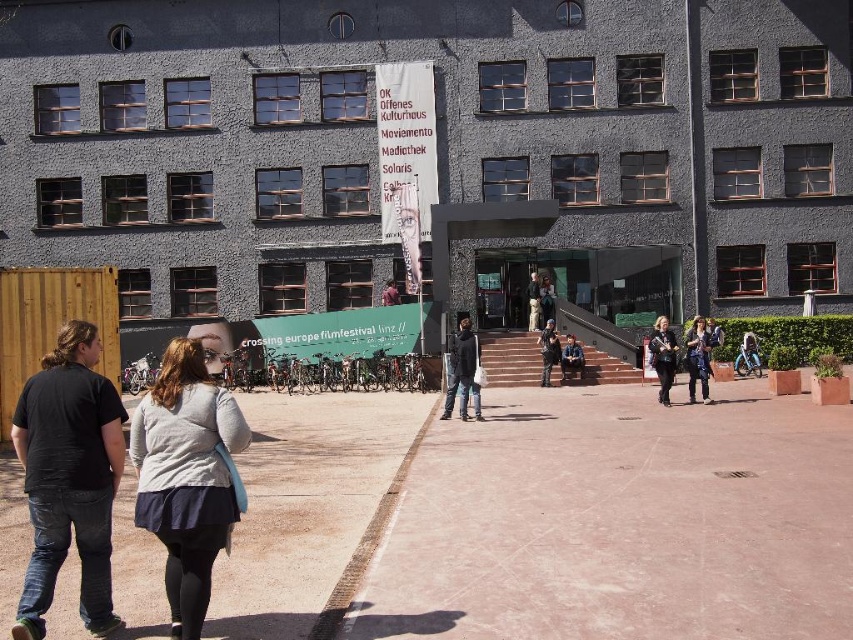
Question: Estimate the real-world distances between objects in this image. Which object is closer to the light gray sweater at center?

Choices:
 (A) camouflage jacket at center
 (B) matte black jacket at lower right

Answer: (B)

Question: Does denim jacket at center appear on the left side of denim jacket at lower right?

Choices:
 (A) no
 (B) yes

Answer: (B)

Question: Does paved concrete sidewalk at lower left appear under denim jacket at lower right?

Choices:
 (A) yes
 (B) no

Answer: (A)

Question: Which point is closer to the camera?

Choices:
 (A) click(x=103, y=580)
 (B) click(x=660, y=333)
 (C) click(x=97, y=353)

Answer: (A)

Question: Which of these objects is positioned farthest from the matte black jacket at lower right?

Choices:
 (A) black cotton shirt at left
 (B) light gray sweater at center
 (C) denim jacket at lower right

Answer: (B)

Question: Is denim jacket at center to the left of matte black jacket at lower right from the viewer's perspective?

Choices:
 (A) yes
 (B) no

Answer: (A)